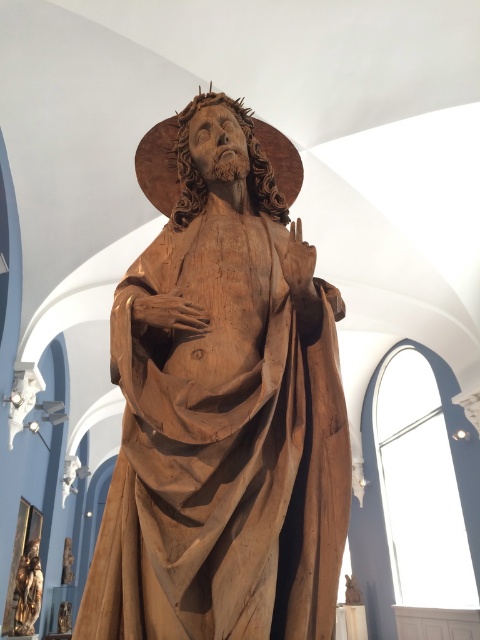
Is wooden statue at center positioned before gold polished statue at lower left?

Yes, it is.

How much distance is there between wooden statue at center and gold polished statue at lower left?

The distance of wooden statue at center from gold polished statue at lower left is 28.32 feet.

Is point (340, 312) positioned in front of point (29, 618)?

Yes, point (340, 312) is in front of point (29, 618).

Locate an element on the screen. wooden statue at center is located at coordinates (224, 413).